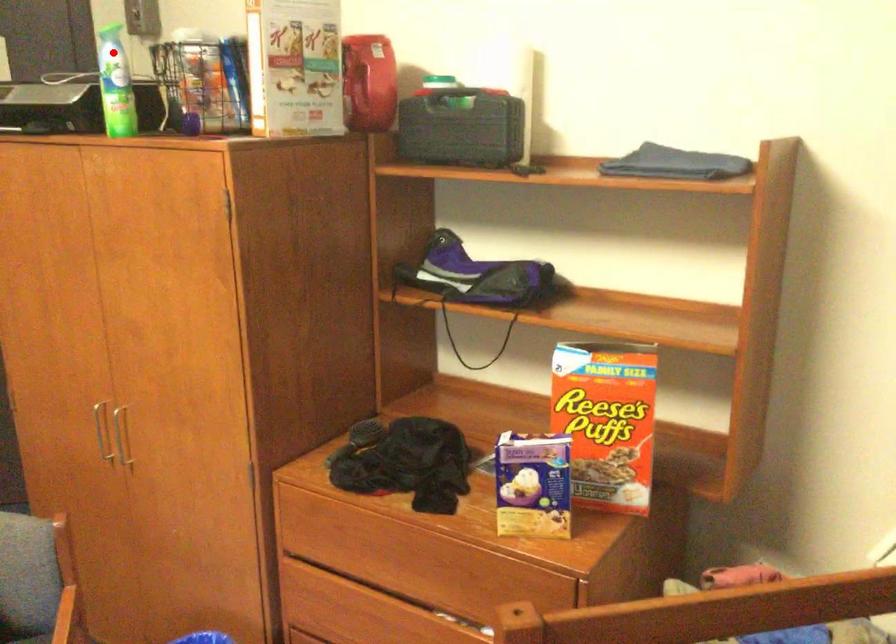
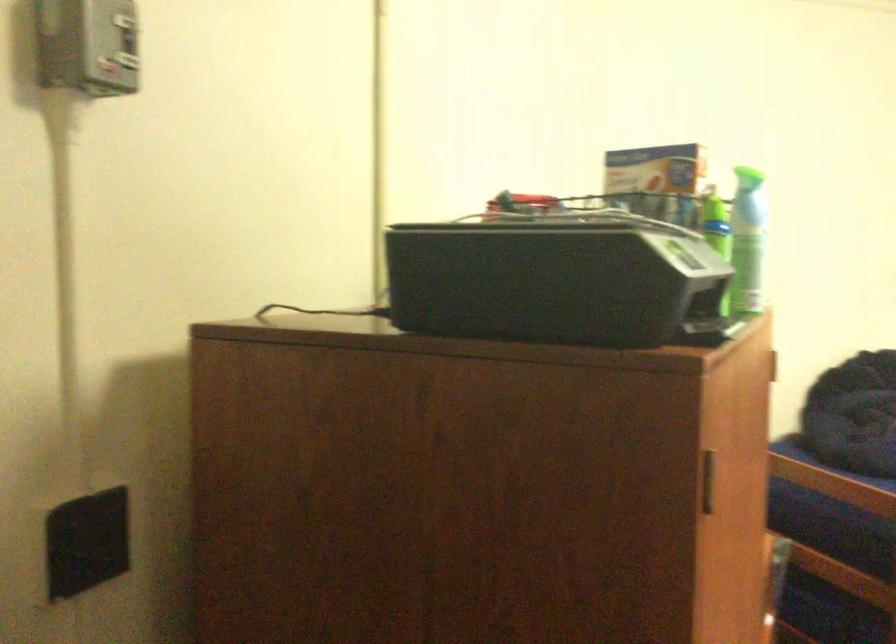
Question: I am providing you with two images of the same scene from different viewpoints. A red point is marked on the first image. Can you still see the location of the red point in image 2?

Choices:
 (A) Yes
 (B) No

Answer: (B)